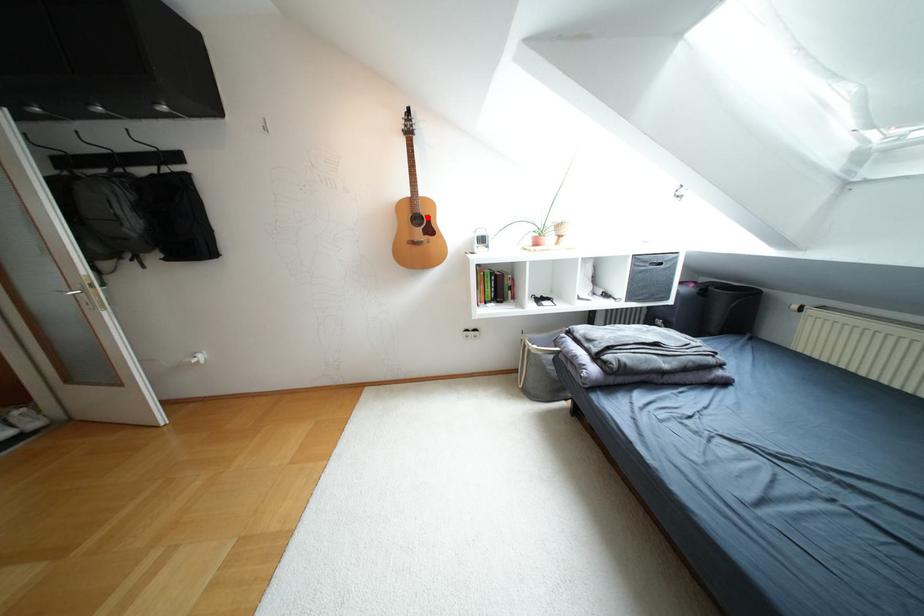
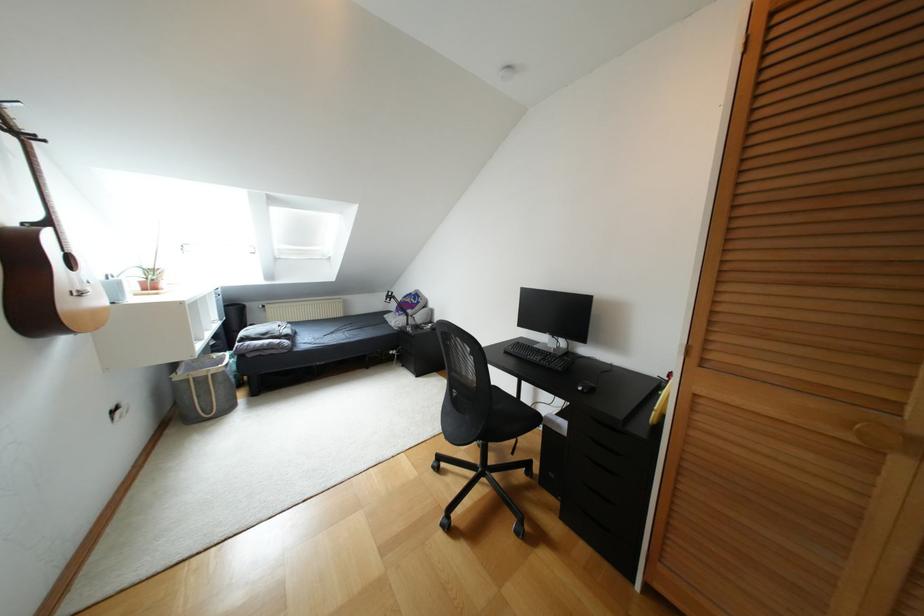
Question: I am providing you with two images of the same scene from different viewpoints. A red point is marked on the first image. Can you still see the location of the red point in image 2?

Choices:
 (A) Yes
 (B) No

Answer: (B)